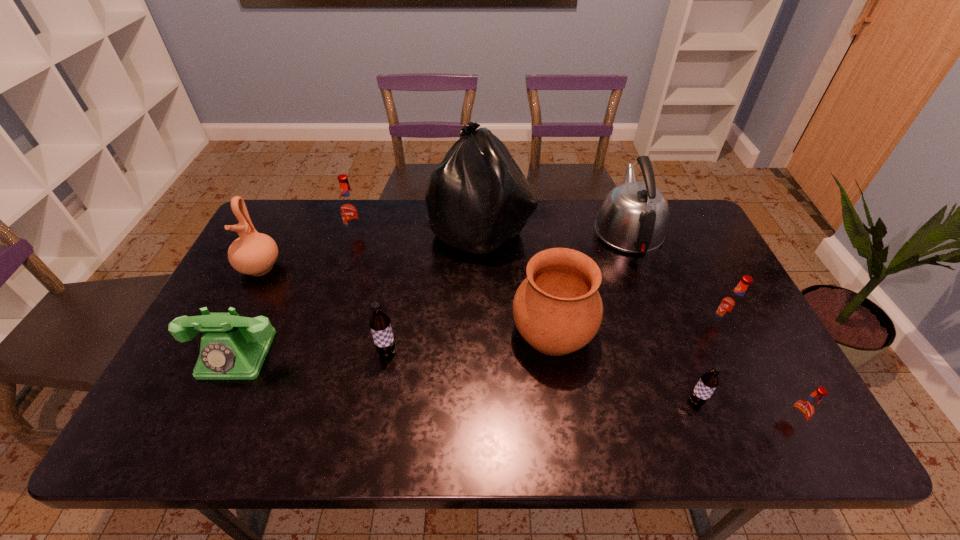
Find the location of `telephone`. telephone is located at coordinates (233, 347).

Locate an element on the screen. The image size is (960, 540). the smallest red root beer is located at coordinates (804, 408).

You are a GUI agent. You are given a task and a screenshot of the screen. Output one action in this format:
    pyautogui.click(x=<x>, y=<y>)
    Task: Click on the rightmost object
    This screenshot has height=540, width=960.
    Given the screenshot: What is the action you would take?
    pyautogui.click(x=804, y=408)

Where is `the second nearest object`? the second nearest object is located at coordinates (709, 381).

The width and height of the screenshot is (960, 540). Find the location of `the smaller brown root beer`. the smaller brown root beer is located at coordinates (709, 381).

Image resolution: width=960 pixels, height=540 pixels. I want to click on free space located 0.070m on the right of the tallest object, so click(553, 228).

The height and width of the screenshot is (540, 960). Find the location of `vacant region located 0.120m on the right of the leftmost red root beer`. vacant region located 0.120m on the right of the leftmost red root beer is located at coordinates (403, 235).

Identify the location of vacant space located on the spout of the left pottery. This screenshot has height=540, width=960. (209, 368).

Where is `free location located on the front of the nearer pottery`? free location located on the front of the nearer pottery is located at coordinates point(566,422).

Locate an element on the screen. Image resolution: width=960 pixels, height=540 pixels. vacant area situated 0.220m on the left of the bigger brown root beer is located at coordinates (290, 352).